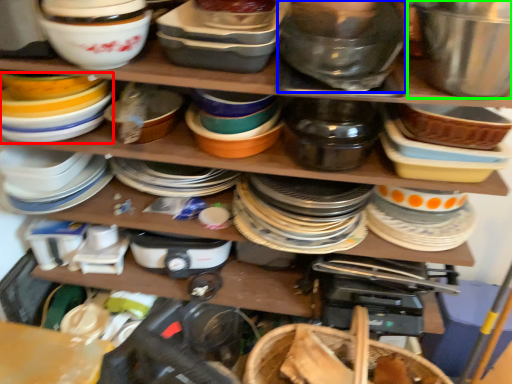
Question: Which is farther away from appliance (highlighted by a red box)? bowl (highlighted by a blue box) or bowl (highlighted by a green box)?

Choices:
 (A) bowl
 (B) bowl

Answer: (B)